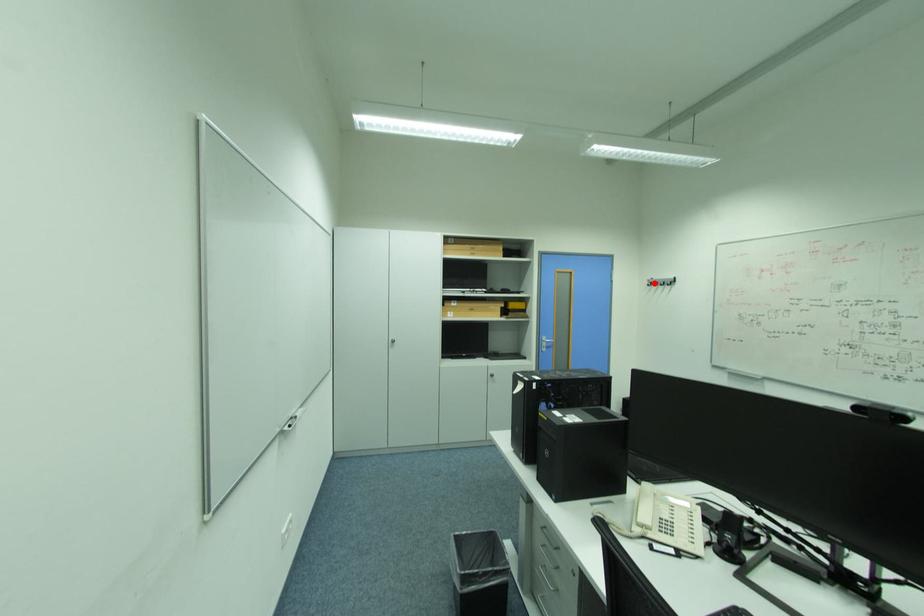
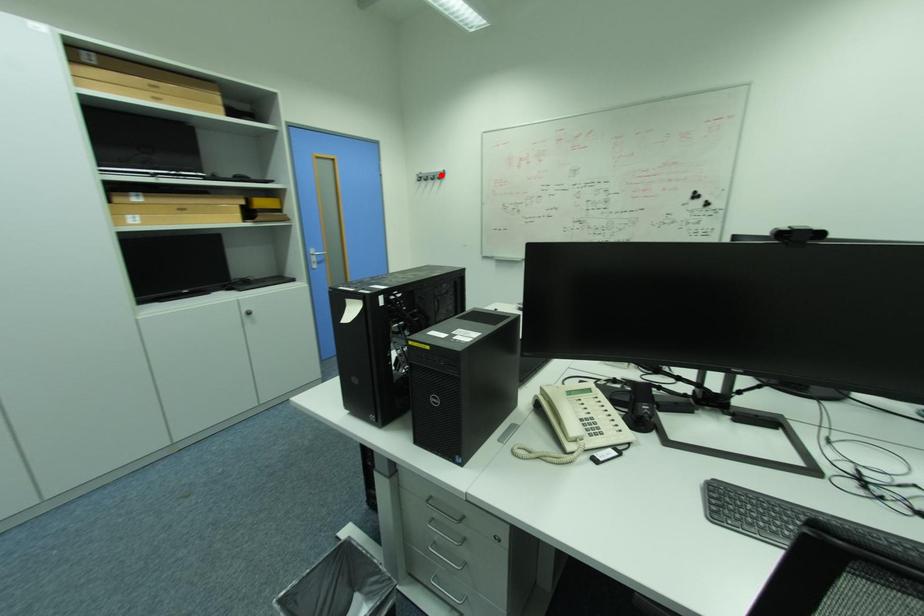
I am providing you with two images of the same scene from different viewpoints. A red point is marked on the first image and another point is marked on the second image. Is the marked point in image1 the same physical position as the marked point in image2?

No